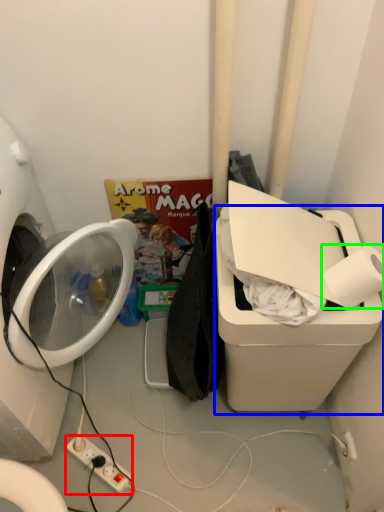
Question: Based on their relative distances, which object is nearer to electric outlet (highlighted by a red box)? Choose from water cooler (highlighted by a blue box) and toilet paper (highlighted by a green box).

Choices:
 (A) water cooler
 (B) toilet paper

Answer: (A)